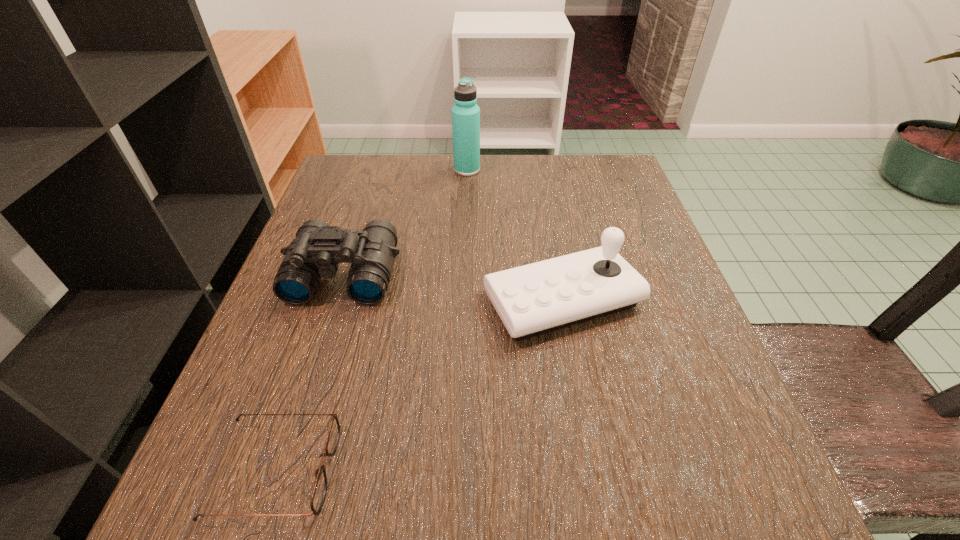
You are a GUI agent. You are given a task and a screenshot of the screen. Output one action in this format:
    pyautogui.click(x=<x>, y=<y>)
    Task: Click on the blank region between the rightmost object and the shortest object
    This screenshot has height=540, width=960.
    Given the screenshot: What is the action you would take?
    pyautogui.click(x=420, y=386)

Where is `vacant area that lies between the third tallest object and the joystick`? The image size is (960, 540). vacant area that lies between the third tallest object and the joystick is located at coordinates (453, 287).

The width and height of the screenshot is (960, 540). I want to click on blank region between the rightmost object and the binoculars, so click(x=453, y=287).

Select which object is the closest to the rightmost object. Please provide its 2D coordinates. Your answer should be formatted as a tuple, i.e. [(x, y)], where the tuple contains the x and y coordinates of a point satisfying the conditions above.

[(318, 248)]

Locate which object ranks in proximity to the thermos bottle. Please provide its 2D coordinates. Your answer should be formatted as a tuple, i.e. [(x, y)], where the tuple contains the x and y coordinates of a point satisfying the conditions above.

[(318, 248)]

At what (x,y) coordinates should I click in order to perform the action: click on free space in the image that satisfies the following two spatial constraints: 1. through the lenses of the joystick; 2. on the right side of the binoculars. Please return your answer as a coordinate pair (x, y). Image resolution: width=960 pixels, height=540 pixels. Looking at the image, I should click on (336, 300).

Identify the location of vacant region that satisfies the following two spatial constraints: 1. through the lenses of the binoculars; 2. on the left side of the rightmost object. (336, 300).

Identify the location of free spot that satisfies the following two spatial constraints: 1. on the front side of the rightmost object; 2. on the right side of the thermos bottle. The image size is (960, 540). (462, 300).

Where is `free space that satisfies the following two spatial constraints: 1. through the lenses of the third tallest object; 2. on the front-facing side of the shortest object`? This screenshot has height=540, width=960. free space that satisfies the following two spatial constraints: 1. through the lenses of the third tallest object; 2. on the front-facing side of the shortest object is located at coordinates (280, 471).

Locate an element on the screen. The image size is (960, 540). free region that satisfies the following two spatial constraints: 1. through the lenses of the binoculars; 2. on the right side of the joystick is located at coordinates (336, 300).